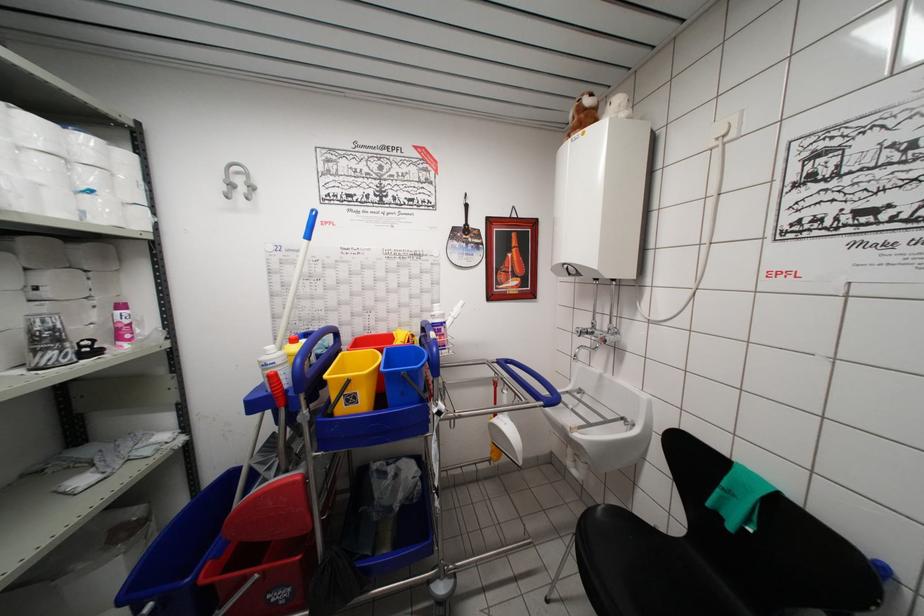
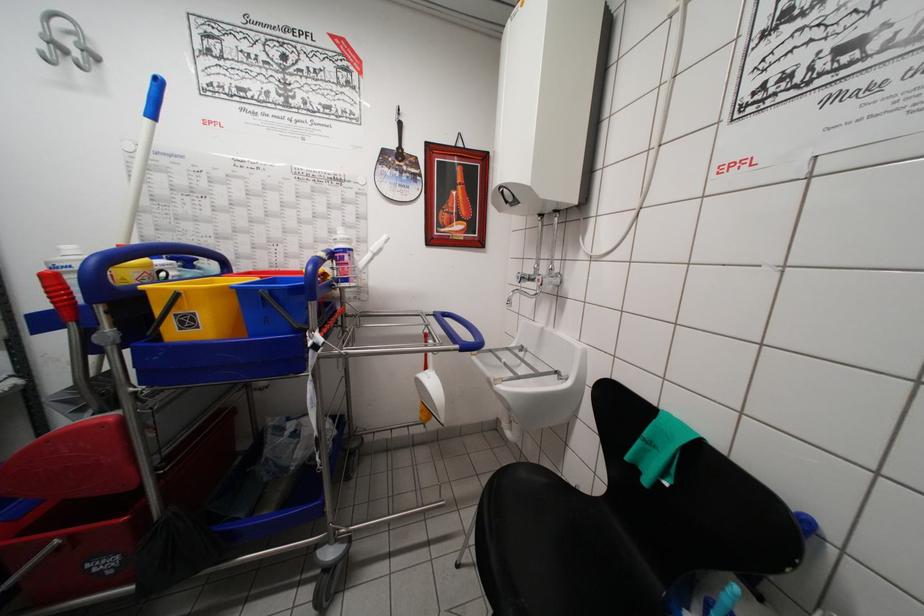
Locate, in the second image, the point that corresponds to the point at 310,246 in the first image.

(151, 124)